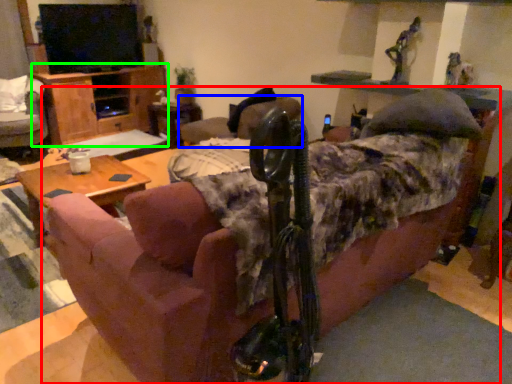
Question: Which is nearer to the studio couch (highlighted by a red box)? chair (highlighted by a blue box) or dresser (highlighted by a green box).

Choices:
 (A) chair
 (B) dresser

Answer: (A)